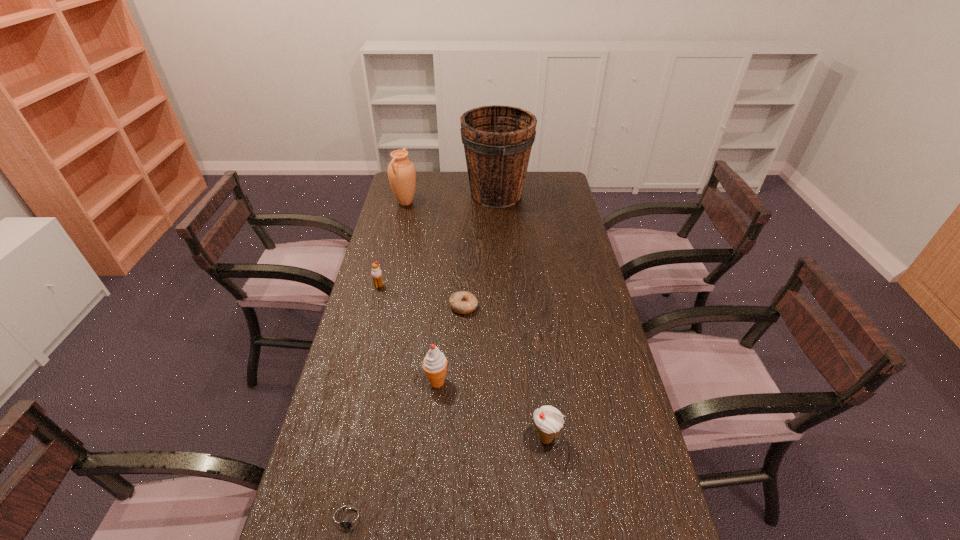
Where is `empty location between the urn and the nearest icecream`? This screenshot has height=540, width=960. empty location between the urn and the nearest icecream is located at coordinates (475, 320).

At what (x,y) coordinates should I click in order to perform the action: click on free spot between the farthest icecream and the doughnut. Please return your answer as a coordinate pair (x, y). Looking at the image, I should click on (421, 296).

Identify the location of free spot between the nearest icecream and the third nearest object. This screenshot has width=960, height=540. (492, 410).

At what (x,y) coordinates should I click in order to perform the action: click on object that can be found as the fourth closest to the sixth tallest object. Please return your answer as a coordinate pair (x, y). Looking at the image, I should click on (497, 139).

Identify which object is located as the third nearest to the bucket. Please provide its 2D coordinates. Your answer should be formatted as a tuple, i.e. [(x, y)], where the tuple contains the x and y coordinates of a point satisfying the conditions above.

[(462, 302)]

Identify which icecream is the second nearest to the farthest icecream. Please provide its 2D coordinates. Your answer should be formatted as a tuple, i.e. [(x, y)], where the tuple contains the x and y coordinates of a point satisfying the conditions above.

[(549, 421)]

Locate which icecream ranks in proximity to the third shortest object. Please provide its 2D coordinates. Your answer should be formatted as a tuple, i.e. [(x, y)], where the tuple contains the x and y coordinates of a point satisfying the conditions above.

[(434, 364)]

The height and width of the screenshot is (540, 960). I want to click on free space that satisfies the following two spatial constraints: 1. on the front side of the doughnut; 2. on the left side of the rightmost icecream, so click(x=458, y=438).

I want to click on free region that satisfies the following two spatial constraints: 1. at the front with a straw on the fourth farthest object; 2. on the right side of the shortest icecream, so click(373, 307).